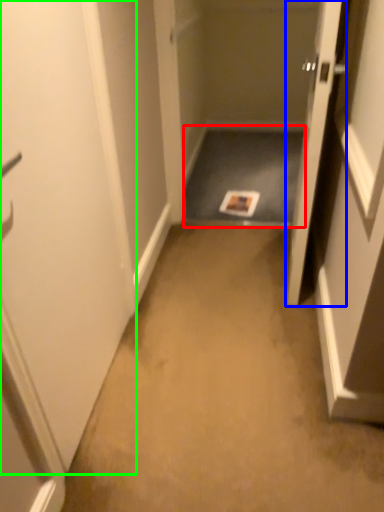
Question: Considering the real-world distances, which object is closest to corridor (highlighted by a red box)? door (highlighted by a blue box) or door (highlighted by a green box).

Choices:
 (A) door
 (B) door

Answer: (A)